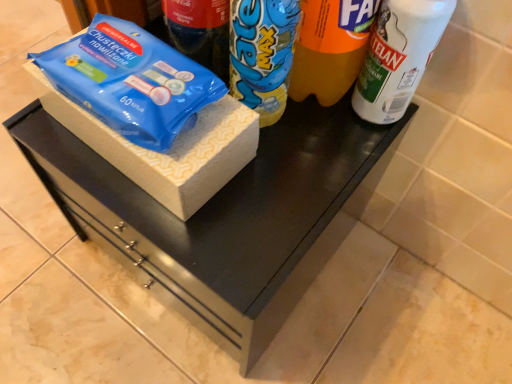
This screenshot has height=384, width=512. What do you see at coordinates (398, 56) in the screenshot?
I see `white matte spray can at upper right` at bounding box center [398, 56].

The height and width of the screenshot is (384, 512). What do you see at coordinates (262, 54) in the screenshot?
I see `blue plastic bottle at center` at bounding box center [262, 54].

Measure the distance between point (245,44) and camera.

They are 40.50 centimeters apart.

Identify the location of wooden box at center. This screenshot has height=384, width=512. (168, 150).

Describe the element at coordinates (330, 48) in the screenshot. The height and width of the screenshot is (384, 512). I see `yellow matte drinking straw at center` at that location.

Locate an element on the screen. The width and height of the screenshot is (512, 384). white matte spray can at upper right is located at coordinates (398, 56).

Would you say wooden box at center is a long distance from blue plastic bottle at center?

They are positioned close to each other.

Does wooden box at center have a lesser width compared to blue plastic bottle at center?

Incorrect, the width of wooden box at center is not less than that of blue plastic bottle at center.

Is wooden box at center turned away from blue plastic bottle at center?

No, wooden box at center is not facing away from blue plastic bottle at center.

Based on their sizes in the image, would you say wooden box at center is bigger or smaller than blue plastic bottle at center?

In the image, wooden box at center appears to be larger than blue plastic bottle at center.

Is point (121, 62) closer to viewer compared to point (396, 6)?

No, it is behind (396, 6).

Considering the relative positions of blue plastic wipes at left and white matte spray can at upper right in the image provided, is blue plastic wipes at left to the left of white matte spray can at upper right from the viewer's perspective?

Yes, blue plastic wipes at left is to the left of white matte spray can at upper right.

From a real-world perspective, is blue plastic wipes at left positioned above or below white matte spray can at upper right?

In terms of real-world spatial position, blue plastic wipes at left is above white matte spray can at upper right.

Looking at this image, how distant is blue plastic wipes at left from white matte spray can at upper right?

22.24 centimeters.

Who is taller, white matte spray can at upper right or yellow matte drinking straw at center?

With more height is yellow matte drinking straw at center.

Can you tell me how much white matte spray can at upper right and yellow matte drinking straw at center differ in facing direction?

There is a 0.00145-degree angle between the facing directions of white matte spray can at upper right and yellow matte drinking straw at center.

Based on their positions, is white matte spray can at upper right located to the left or right of yellow matte drinking straw at center?

white matte spray can at upper right is to the right of yellow matte drinking straw at center.

Looking at their sizes, would you say white matte spray can at upper right is wider or thinner than yellow matte drinking straw at center?

Clearly, white matte spray can at upper right has less width compared to yellow matte drinking straw at center.

Is blue plastic bottle at center oriented away from wooden box at center?

That's not correct — blue plastic bottle at center is not looking away from wooden box at center.

From the image's perspective, would you say blue plastic bottle at center is positioned over wooden box at center?

Indeed, from the image's perspective, blue plastic bottle at center is shown above wooden box at center.

Between blue plastic bottle at center and wooden box at center, which one has larger width?

wooden box at center.

From the image's perspective, is blue plastic wipes at left beneath wooden box at center?

No, from the image's perspective, blue plastic wipes at left is not below wooden box at center.

Would you consider blue plastic wipes at left to be distant from wooden box at center?

No, blue plastic wipes at left is not far from wooden box at center.

Is wooden box at center completely or partially inside blue plastic wipes at left?

No, wooden box at center is located outside of blue plastic wipes at left.

Based on the photo, which object is thinner, blue plastic wipes at left or wooden box at center?

blue plastic wipes at left.

Does white matte spray can at upper right have a smaller size compared to wooden box at center?

Indeed, white matte spray can at upper right has a smaller size compared to wooden box at center.

Could you tell me if white matte spray can at upper right is facing wooden box at center?

No, white matte spray can at upper right is not oriented towards wooden box at center.

From the image's perspective, is white matte spray can at upper right under wooden box at center?

No, from the image's perspective, white matte spray can at upper right is not below wooden box at center.

Considering the relative positions of white matte spray can at upper right and wooden box at center in the image provided, is white matte spray can at upper right to the left or to the right of wooden box at center?

Clearly, white matte spray can at upper right is on the right of wooden box at center in the image.

Between blue plastic wipes at left and yellow matte drinking straw at center, which one has smaller width?

Thinner between the two is yellow matte drinking straw at center.

Considering the relative sizes of blue plastic wipes at left and yellow matte drinking straw at center in the image provided, is blue plastic wipes at left bigger than yellow matte drinking straw at center?

Incorrect, blue plastic wipes at left is not larger than yellow matte drinking straw at center.

Is blue plastic wipes at left oriented towards yellow matte drinking straw at center?

No, blue plastic wipes at left does not turn towards yellow matte drinking straw at center.

Where is `yoghurt that appears in front of the wooden box at center`? yoghurt that appears in front of the wooden box at center is located at coordinates (262, 54).

Where is `food on the left of white matte spray can at upper right`? Image resolution: width=512 pixels, height=384 pixels. food on the left of white matte spray can at upper right is located at coordinates (131, 81).

When comparing their distances from white matte spray can at upper right, does yellow matte drinking straw at center or blue plastic wipes at left seem further?

blue plastic wipes at left is positioned further to the anchor white matte spray can at upper right.

Which object lies further to the anchor point blue plastic bottle at center, white matte spray can at upper right or blue plastic wipes at left?

white matte spray can at upper right lies further to blue plastic bottle at center than the other object.

Which object lies nearer to the anchor point blue plastic bottle at center, yellow matte drinking straw at center or white matte spray can at upper right?

The object closer to blue plastic bottle at center is yellow matte drinking straw at center.

Considering their positions, is blue plastic bottle at center positioned closer to white matte spray can at upper right than yellow matte drinking straw at center?

Among the two, yellow matte drinking straw at center is located nearer to white matte spray can at upper right.

When comparing their distances from blue plastic wipes at left, does yellow matte drinking straw at center or wooden box at center seem closer?

wooden box at center is positioned closer to the anchor blue plastic wipes at left.

Which object lies nearer to the anchor point white matte spray can at upper right, blue plastic wipes at left or yellow matte drinking straw at center?

yellow matte drinking straw at center is positioned closer to the anchor white matte spray can at upper right.

Which object lies further to the anchor point wooden box at center, white matte spray can at upper right or blue plastic wipes at left?

The object further to wooden box at center is white matte spray can at upper right.

When comparing their distances from blue plastic wipes at left, does blue plastic bottle at center or white matte spray can at upper right seem closer?

The object closer to blue plastic wipes at left is blue plastic bottle at center.

Where is `box between blue plastic wipes at left and white matte spray can at upper right`? box between blue plastic wipes at left and white matte spray can at upper right is located at coordinates (168, 150).

Locate an element on the screen. This screenshot has width=512, height=384. drinking straw situated between wooden box at center and white matte spray can at upper right from left to right is located at coordinates (330, 48).

The height and width of the screenshot is (384, 512). Find the location of `box between blue plastic wipes at left and yellow matte drinking straw at center from left to right`. box between blue plastic wipes at left and yellow matte drinking straw at center from left to right is located at coordinates (168, 150).

Locate an element on the screen. The width and height of the screenshot is (512, 384). yoghurt between blue plastic wipes at left and white matte spray can at upper right is located at coordinates (262, 54).